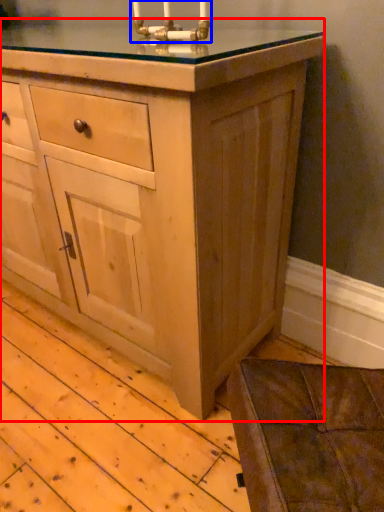
Question: Which object is closer to the camera taking this photo, chest of drawers (highlighted by a red box) or candle holder (highlighted by a blue box)?

Choices:
 (A) chest of drawers
 (B) candle holder

Answer: (A)